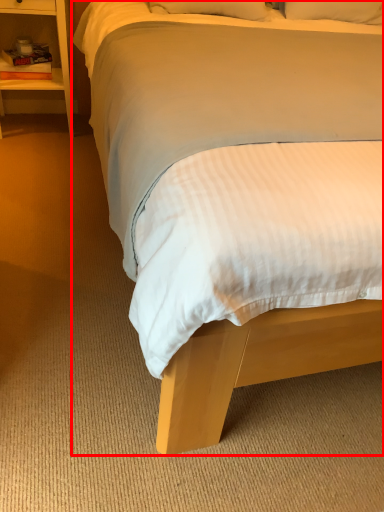
Question: From the image's perspective, where is bed (annotated by the red box) located relative to nightstand?

Choices:
 (A) below
 (B) above

Answer: (A)